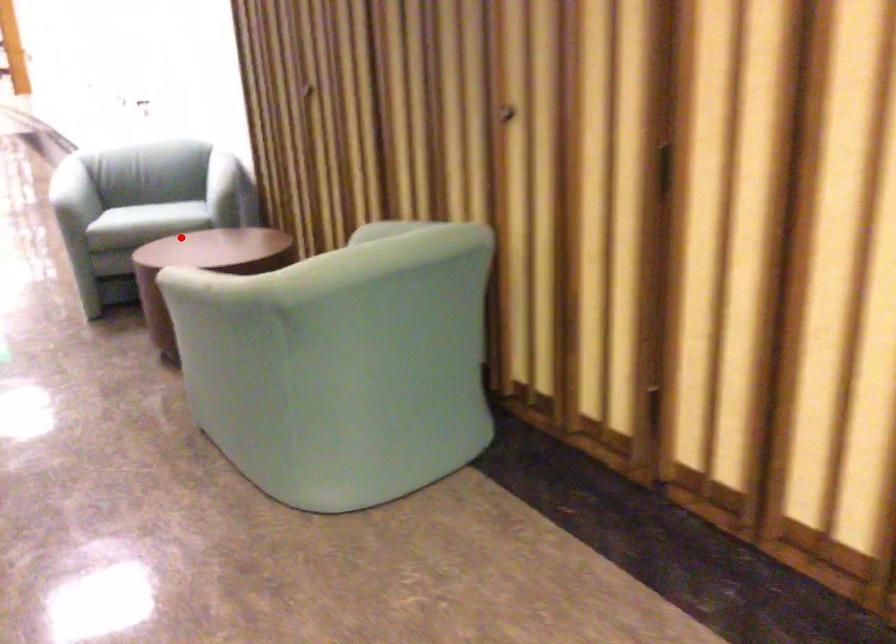
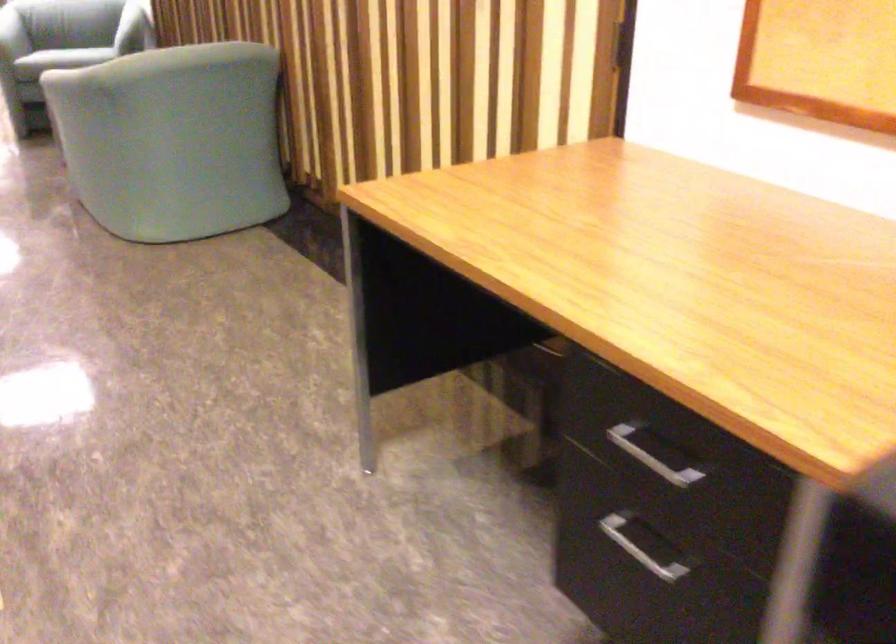
Question: A red point is marked in image1. In image2, is the corresponding 3D point closer to the camera or farther? Reply with the corresponding letter.

Choices:
 (A) The corresponding 3D point is closer.
 (B) The corresponding 3D point is farther.

Answer: (B)